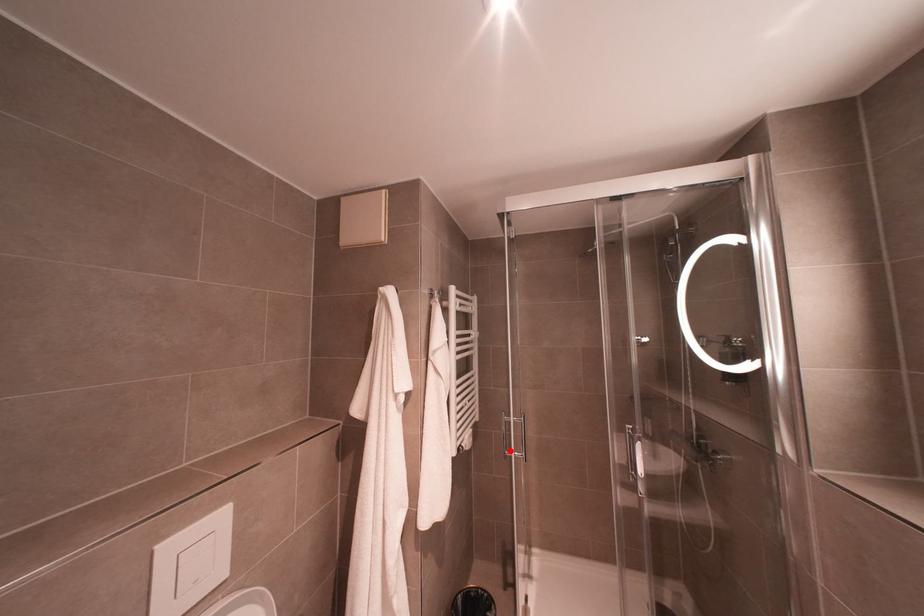
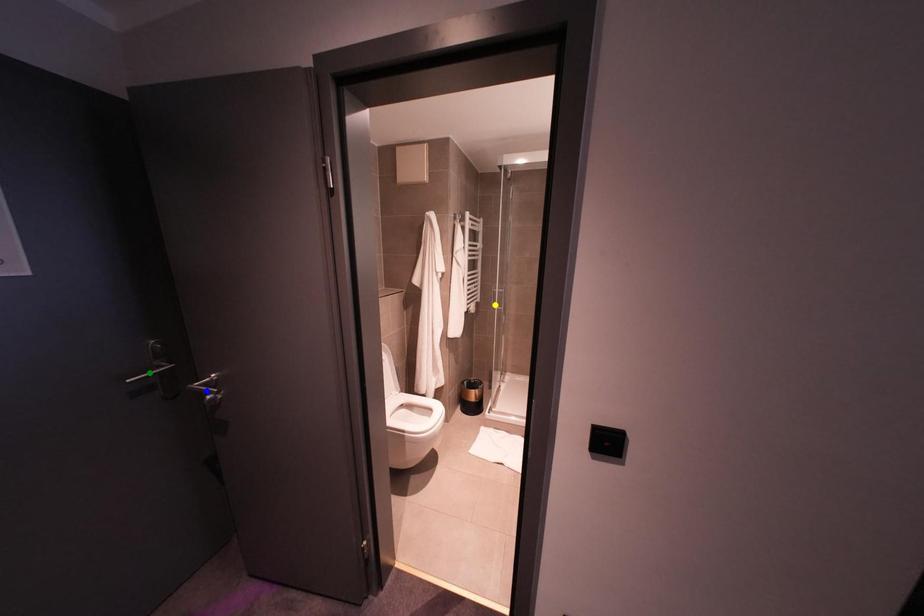
Question: I am providing you with two images of the same scene from different viewpoints. A red point is marked on the first image. You are given multiple points on the second image. Can you choose the point in image 2 that corresponds to the point in image 1?

Choices:
 (A) blue point
 (B) green point
 (C) yellow point

Answer: (C)